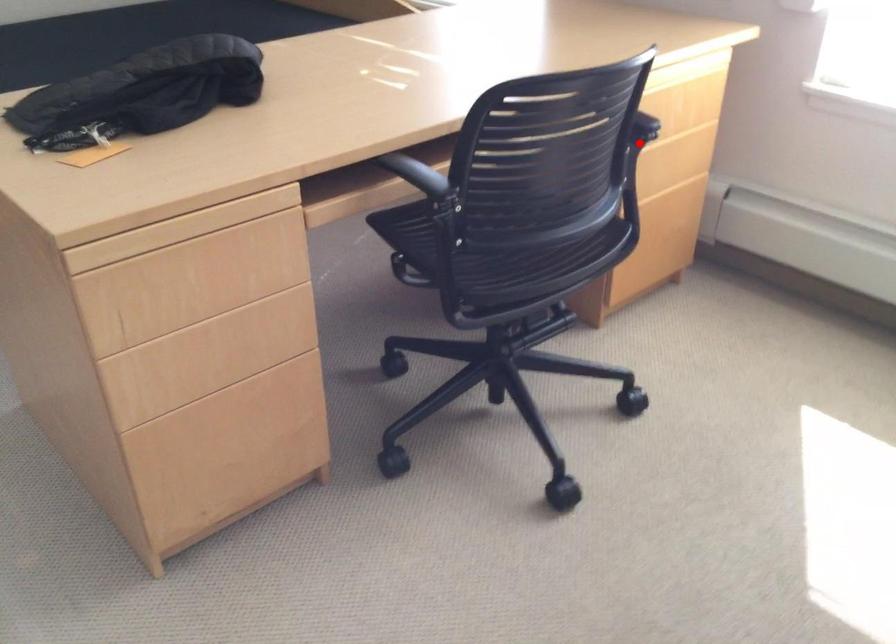
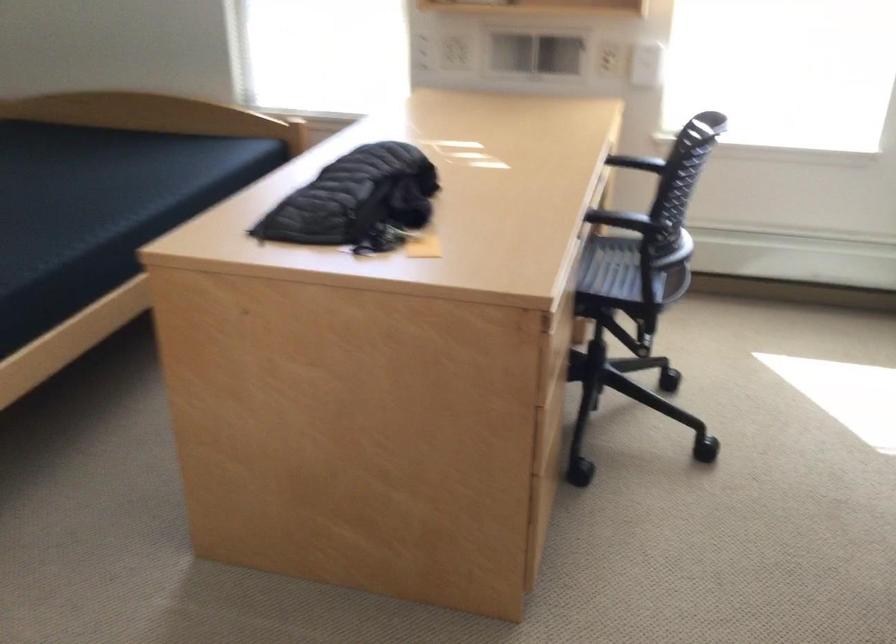
Question: I am providing you with two images of the same scene from different viewpoints. A red point is marked on the first image. Is the red point's position out of view in image 2?

Choices:
 (A) Yes
 (B) No

Answer: (A)